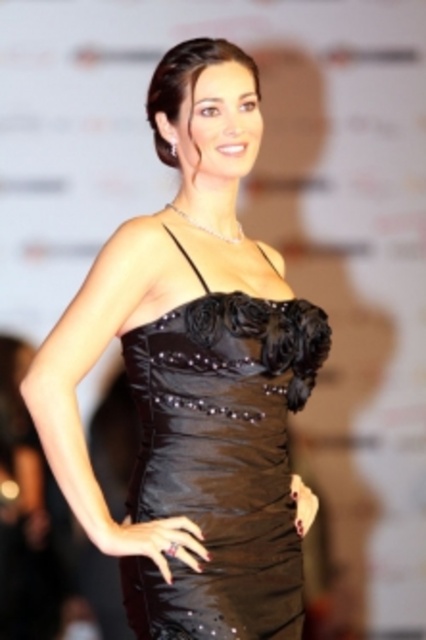
Question: Which object is farther from the camera taking this photo?

Choices:
 (A) shiny black dress at center
 (B) shiny satin dress at center

Answer: (A)

Question: Which object appears closest to the camera in this image?

Choices:
 (A) shiny black dress at center
 (B) shiny satin dress at center

Answer: (B)

Question: Where is shiny satin dress at center located in relation to shiny black dress at center in the image?

Choices:
 (A) left
 (B) right

Answer: (A)

Question: Does shiny satin dress at center appear under shiny black dress at center?

Choices:
 (A) yes
 (B) no

Answer: (B)

Question: Can you confirm if shiny satin dress at center is positioned above shiny black dress at center?

Choices:
 (A) no
 (B) yes

Answer: (B)

Question: Which point is closer to the camera taking this photo?

Choices:
 (A) (124, 348)
 (B) (250, 296)

Answer: (B)